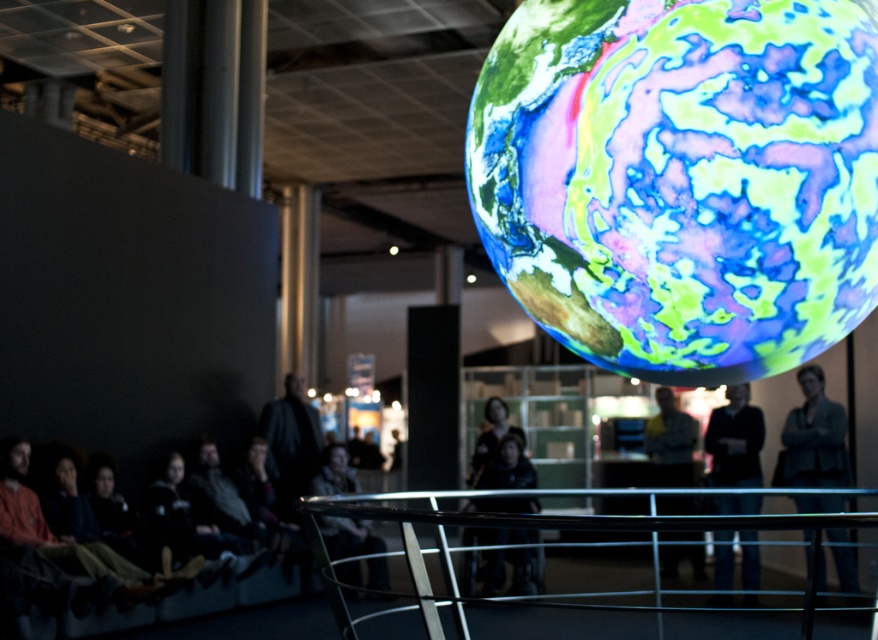
Who is shorter, translucent glass globe at upper center or dark gray jacket at center?

With less height is translucent glass globe at upper center.

Does translucent glass globe at upper center appear on the right side of dark gray jacket at center?

Indeed, translucent glass globe at upper center is positioned on the right side of dark gray jacket at center.

The width and height of the screenshot is (878, 640). I want to click on translucent glass globe at upper center, so click(x=681, y=179).

The image size is (878, 640). I want to click on translucent glass globe at upper center, so click(x=681, y=179).

Which of these two, light brown leather jacket at center or camouflage jacket at center, stands taller?

Standing taller between the two is light brown leather jacket at center.

Which is above, light brown leather jacket at center or camouflage jacket at center?

light brown leather jacket at center is above.

Is point (689, 480) closer to camera compared to point (321, 493)?

That is False.

Locate an element on the screen. light brown leather jacket at center is located at coordinates (670, 442).

Is matte gray jacket at right positioned behind light brown leather jacket at center?

No, matte gray jacket at right is closer to the viewer.

Is matte gray jacket at right below light brown leather jacket at center?

No.

Who is more distant from viewer, (831, 548) or (686, 477)?

The point (686, 477) is behind.

Identify the location of matte gray jacket at right. (814, 436).